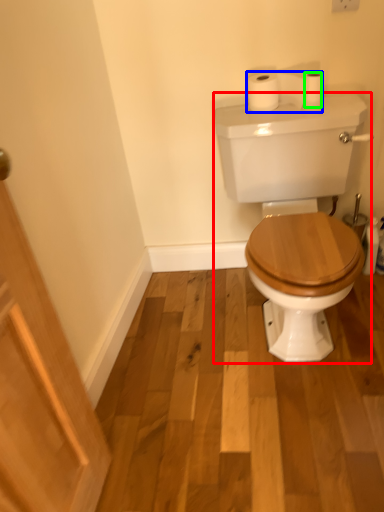
Question: Based on their relative distances, which object is farther from porcelain (highlighted by a red box)? Choose from toilet paper (highlighted by a blue box) and toilet paper (highlighted by a green box).

Choices:
 (A) toilet paper
 (B) toilet paper

Answer: (B)